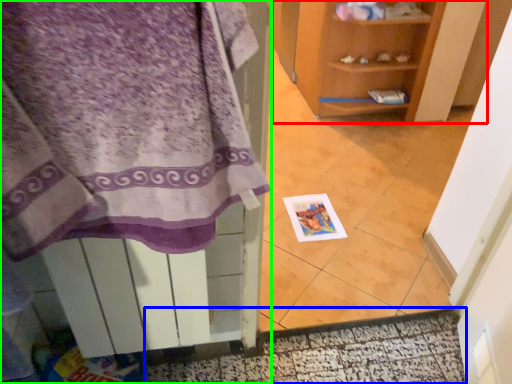
Question: Considering the real-world distances, which object is closest to shelf (highlighted by a red box)? door (highlighted by a blue box) or cabinetry (highlighted by a green box).

Choices:
 (A) door
 (B) cabinetry

Answer: (A)